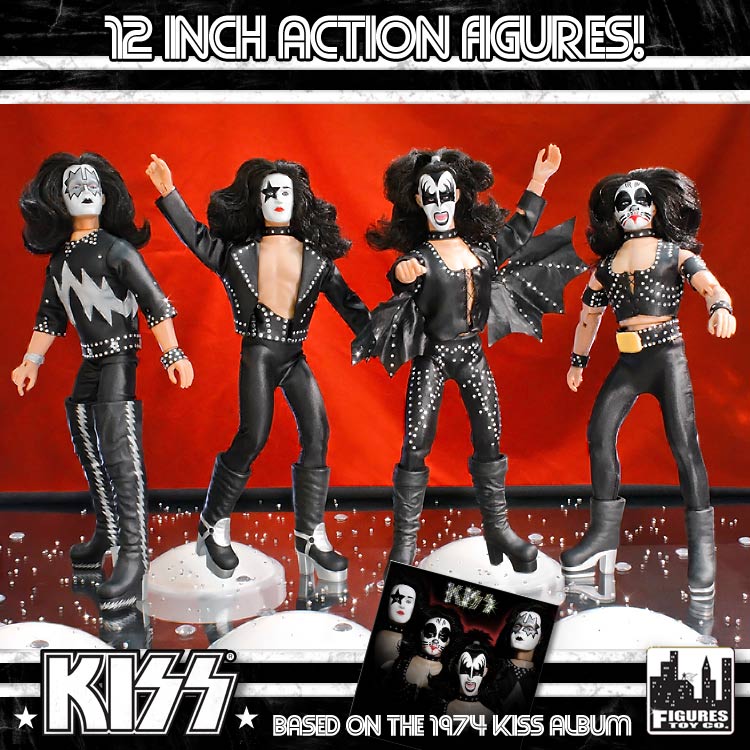
Where is `shoe`? The width and height of the screenshot is (750, 750). shoe is located at coordinates (309, 535), (220, 529), (122, 574), (91, 548), (406, 541), (502, 535), (586, 552), (690, 567).